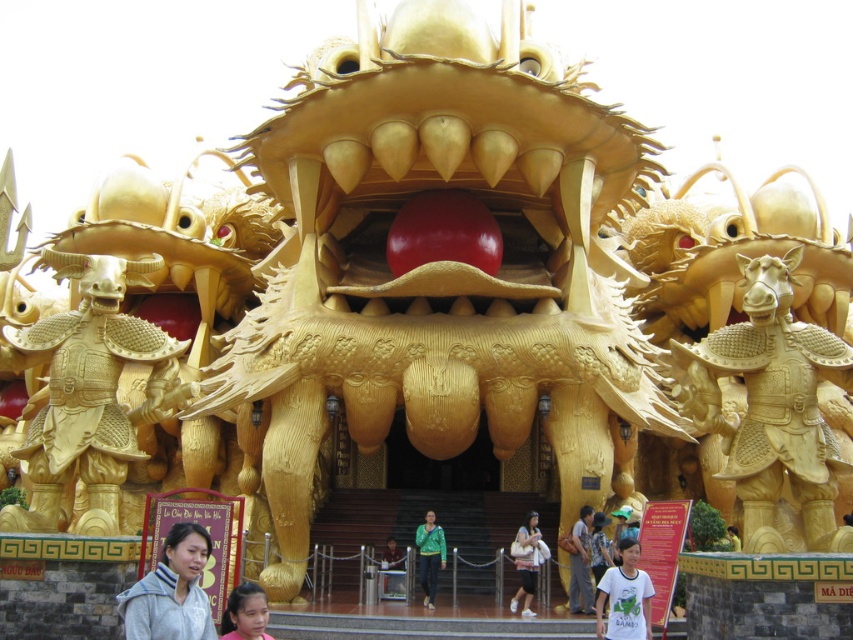
Can you confirm if gold textured armor at right is positioned above white cotton t-shirt at center?

Indeed, gold textured armor at right is positioned over white cotton t-shirt at center.

Is gold textured armor at right below white cotton t-shirt at center?

No.

Is point (831, 381) positioned behind point (630, 618)?

Yes, point (831, 381) is behind point (630, 618).

At what (x,y) coordinates should I click in order to perform the action: click on gold textured armor at right. Please return your answer as a coordinate pair (x, y). Looking at the image, I should click on (772, 410).

At what (x,y) coordinates should I click in order to perform the action: click on gold textured armor at right. Please return your answer as a coordinate pair (x, y). The width and height of the screenshot is (853, 640). Looking at the image, I should click on (772, 410).

Is gold textured armor at right taller than smooth skin face at center?

Yes.

Where is `gold textured armor at right`? This screenshot has height=640, width=853. gold textured armor at right is located at coordinates (772, 410).

Which is more to the right, gold textured dragon head at center or gold textured armor at right?

From the viewer's perspective, gold textured armor at right appears more on the right side.

Which of these two, gold textured dragon head at center or gold textured armor at right, stands taller?

With more height is gold textured dragon head at center.

Does point (260, 141) come in front of point (720, 429)?

No.

Locate an element on the screen. The image size is (853, 640). gold textured dragon head at center is located at coordinates (438, 268).